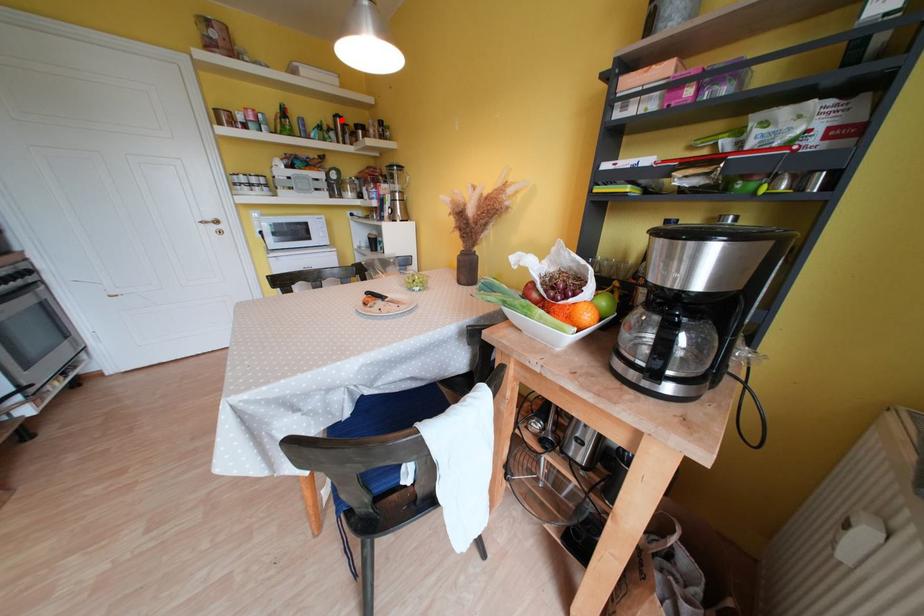
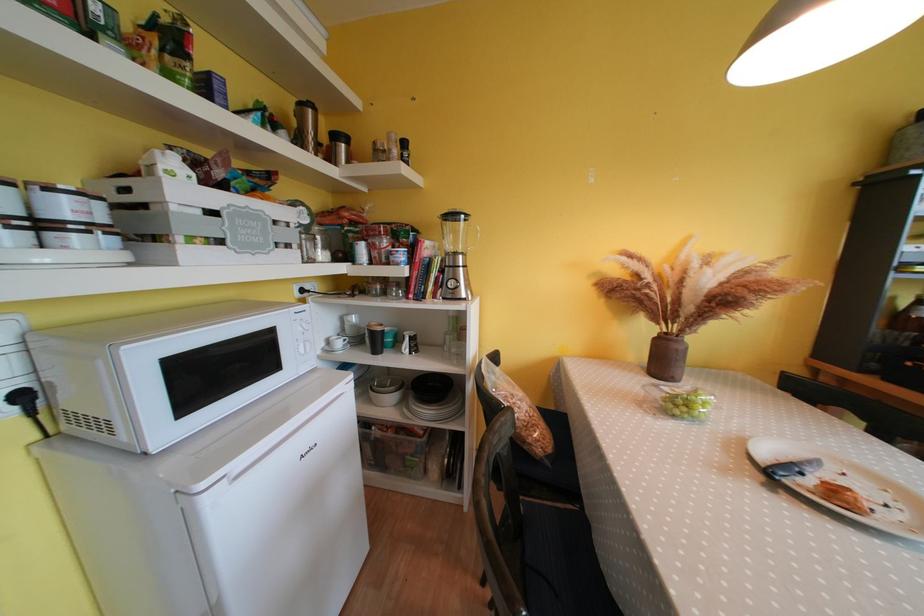
Find the pixel in the second image that matches the highlighted location in the first image.

(308, 108)